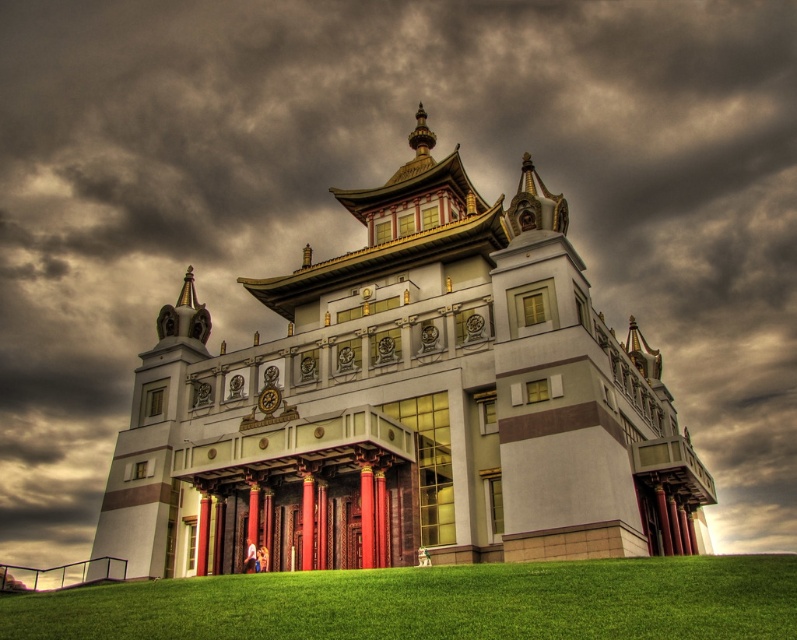
You are standing in front of a traditional East Asian architectural structure. The white glossy palace at center is the main building in view. If you want to take a photo that includes the entire building without cropping any part of it, what should you consider about your current position?

The white glossy palace at center is 128.28 feet away from you. To capture the entire building in your photo without cropping, you need to ensure you are positioned far enough away to fit the entire structure into the frame, considering the distance of 128.28 feet.

You are standing in front of the white glossy palace at center and want to place a decorative stone on the ground. Where should you place it so it is on the same level as the green grass at lower center?

You should place the decorative stone on the ground at the lower center, where the green grass at lower center is located, since the white glossy palace at center is situated above it.